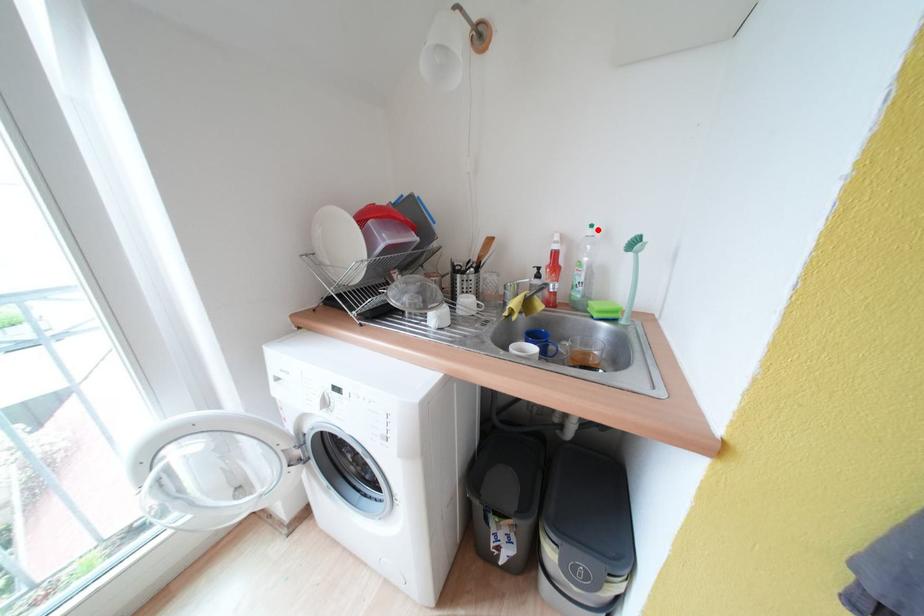
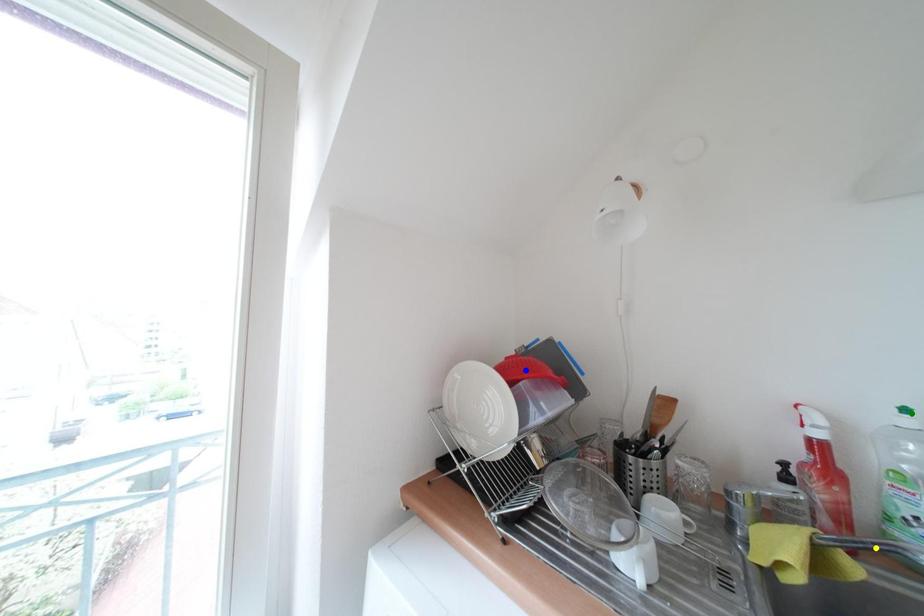
Question: I am providing you with two images of the same scene from different viewpoints. A red point is marked on the first image. You are given multiple points on the second image. Can you choose the point in image 2 that corresponds to the point in image 1?

Choices:
 (A) yellow point
 (B) blue point
 (C) green point

Answer: (C)